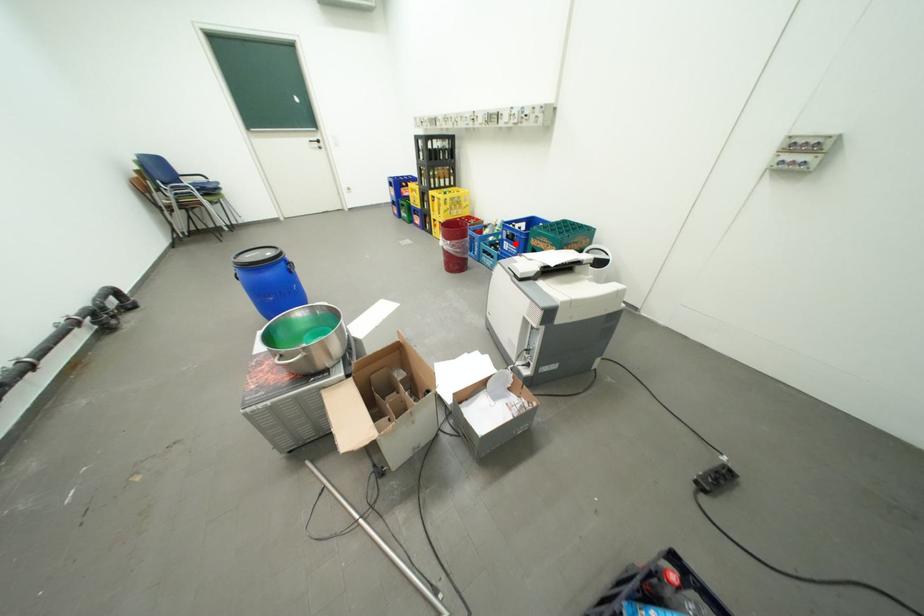
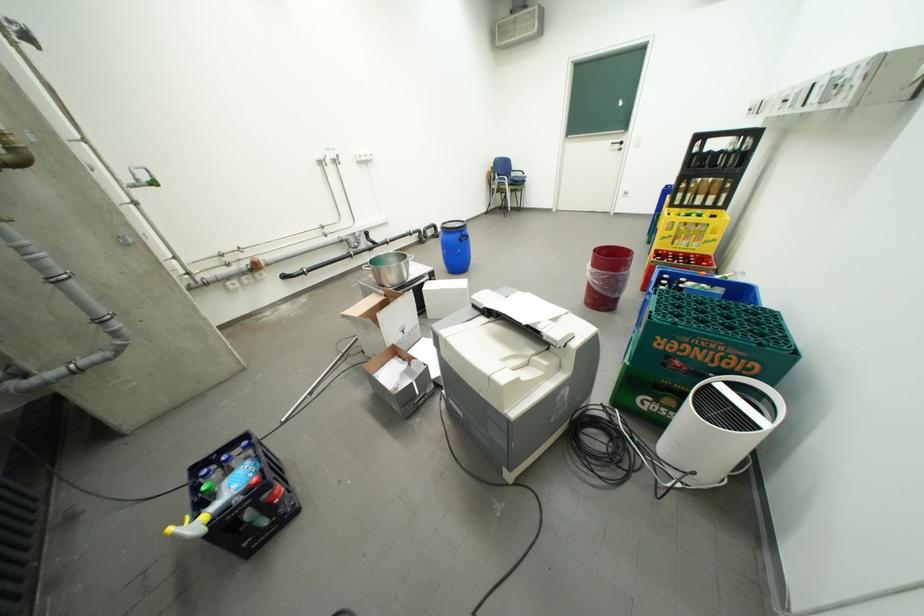
Question: I am providing you with two images of the same scene from different viewpoints. A red point is marked on the first image. Can you still see the location of the red point in image 2?

Choices:
 (A) Yes
 (B) No

Answer: (B)